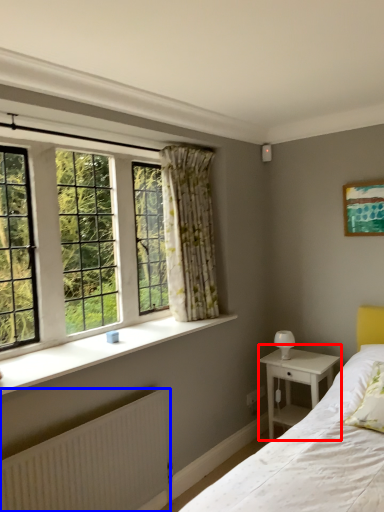
Question: Which point is closer to the camera, nightstand (highlighted by a red box) or radiator (highlighted by a blue box)?

Choices:
 (A) nightstand
 (B) radiator

Answer: (B)